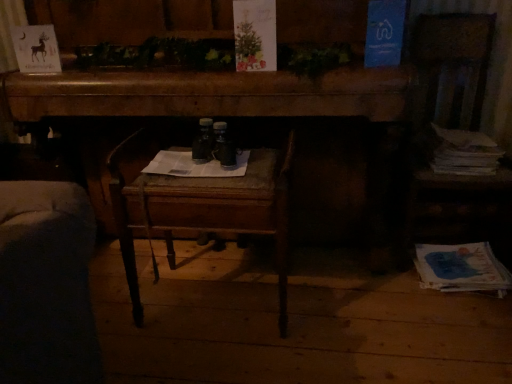
Question: From a real-world perspective, is wooden chair at center above or below blue paper at lower right, the 2th magazine from the top?

Choices:
 (A) above
 (B) below

Answer: (A)

Question: Is wooden chair at center bigger or smaller than blue paper at lower right, the 2th magazine from the top?

Choices:
 (A) small
 (B) big

Answer: (B)

Question: Estimate the real-world distances between objects in this image. Which object is closer to the white paper stack at right, positioned as the 2th magazine in bottom-to-top order?

Choices:
 (A) blue paper at lower right, the 1th magazine positioned from the bottom
 (B) wooden desk at center
 (C) wooden chair at center

Answer: (A)

Question: Considering the real-world distances, which object is closest to the wooden chair at center?

Choices:
 (A) white paper stack at right, the first magazine viewed from the top
 (B) blue paper at lower right, the 1th magazine positioned from the bottom
 (C) wooden desk at center

Answer: (C)